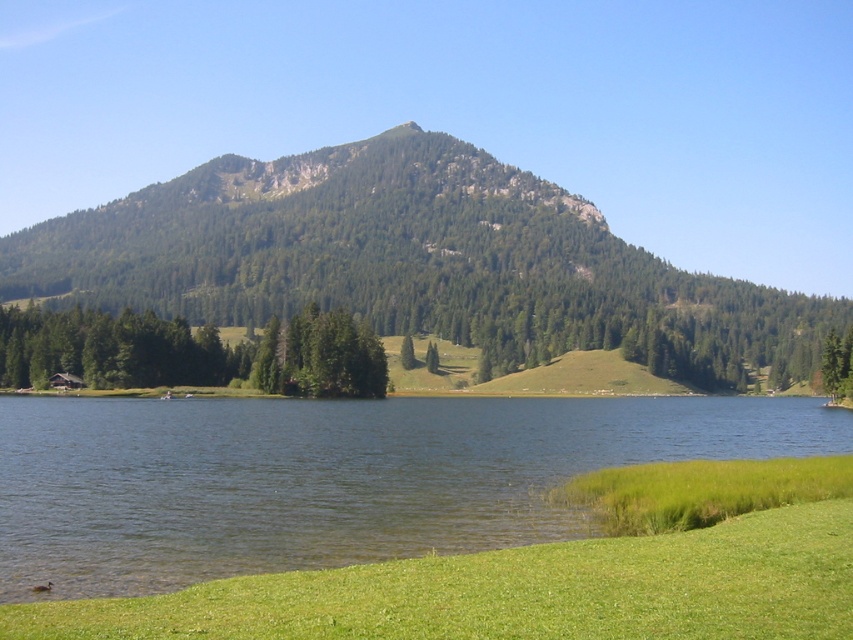
Question: Is green grassy shore at lower right thinner than green forested mountain at center?

Choices:
 (A) no
 (B) yes

Answer: (B)

Question: Which object is farther from the camera taking this photo?

Choices:
 (A) green grassy shore at lower right
 (B) green forested mountain at center

Answer: (B)

Question: Which point is farther from the camera taking this photo?

Choices:
 (A) click(25, 472)
 (B) click(262, 250)

Answer: (B)

Question: Which of the following is the closest to the observer?

Choices:
 (A) green forested mountain at center
 (B) green grassy shore at lower right

Answer: (B)

Question: Is green grassy shore at lower right closer to the viewer compared to green forested mountain at center?

Choices:
 (A) yes
 (B) no

Answer: (A)

Question: Does green grassy shore at lower right have a greater width compared to green forested mountain at center?

Choices:
 (A) no
 (B) yes

Answer: (A)